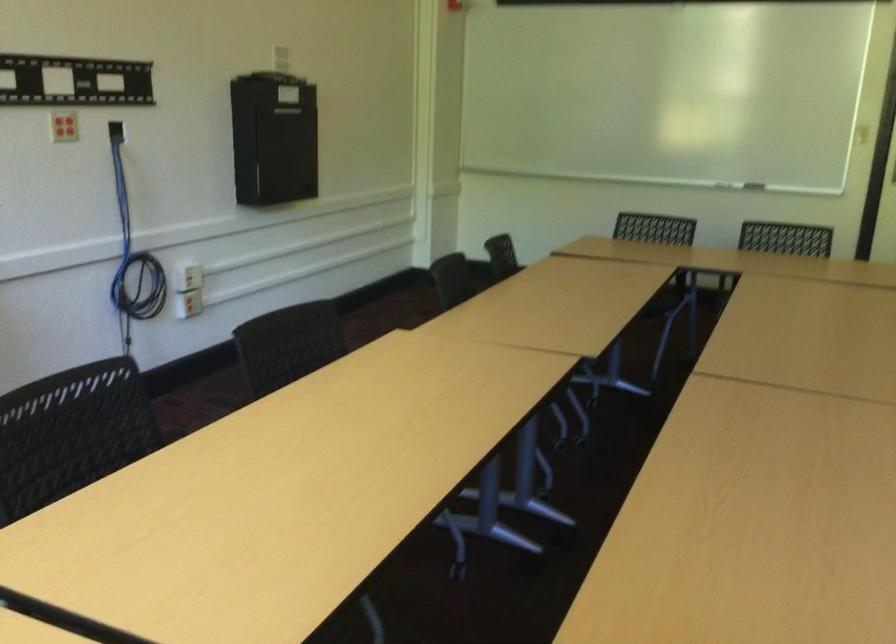
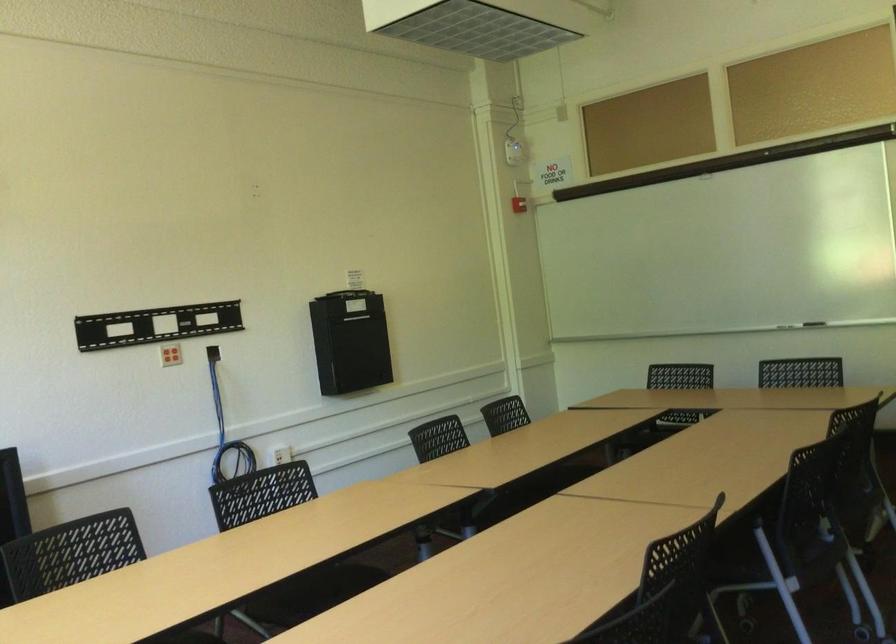
What movement of the cameraman would produce the second image?

The cameraman moved toward right, backward.